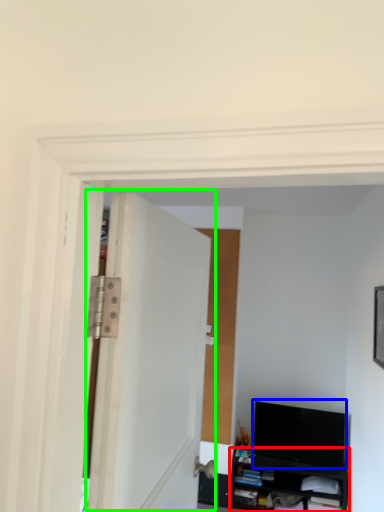
Question: Considering the real-world distances, which object is closest to cabinetry (highlighted by a red box)? computer monitor (highlighted by a blue box) or door (highlighted by a green box).

Choices:
 (A) computer monitor
 (B) door

Answer: (A)